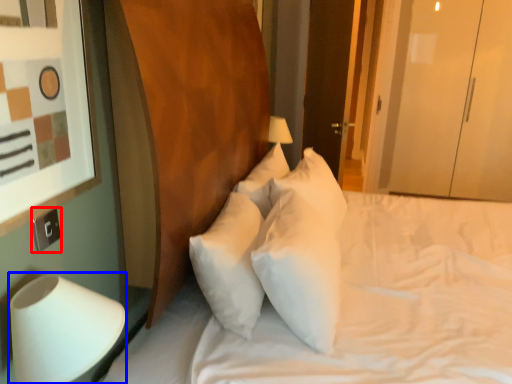
Question: Which of the following is the farthest to the observer, electric outlet (highlighted by a red box) or table lamp (highlighted by a blue box)?

Choices:
 (A) electric outlet
 (B) table lamp

Answer: (A)